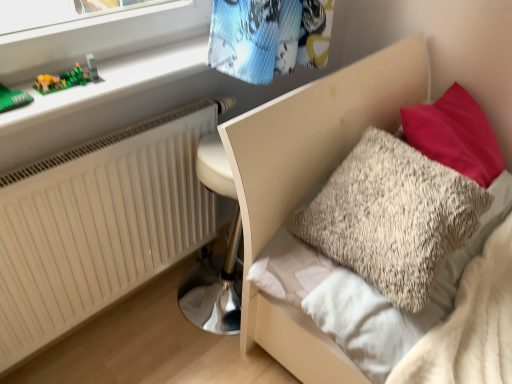
Question: Would you say green plastic toy at upper left is inside or outside white matte radiator at lower left?

Choices:
 (A) inside
 (B) outside

Answer: (B)

Question: Is green plastic toy at upper left taller or shorter than white matte radiator at lower left?

Choices:
 (A) tall
 (B) short

Answer: (B)

Question: Based on their relative distances, which object is nearer to the green plastic blocks at upper left?

Choices:
 (A) fluffy beige pillow at upper right
 (B) white matte radiator at lower left
 (C) fluffy beige pillow at upper right
 (D) green plastic toy at upper left

Answer: (D)

Question: Which is farther from the fluffy beige pillow at upper right?

Choices:
 (A) white matte radiator at lower left
 (B) fluffy beige pillow at upper right
 (C) green plastic toy at upper left
 (D) green plastic blocks at upper left

Answer: (C)